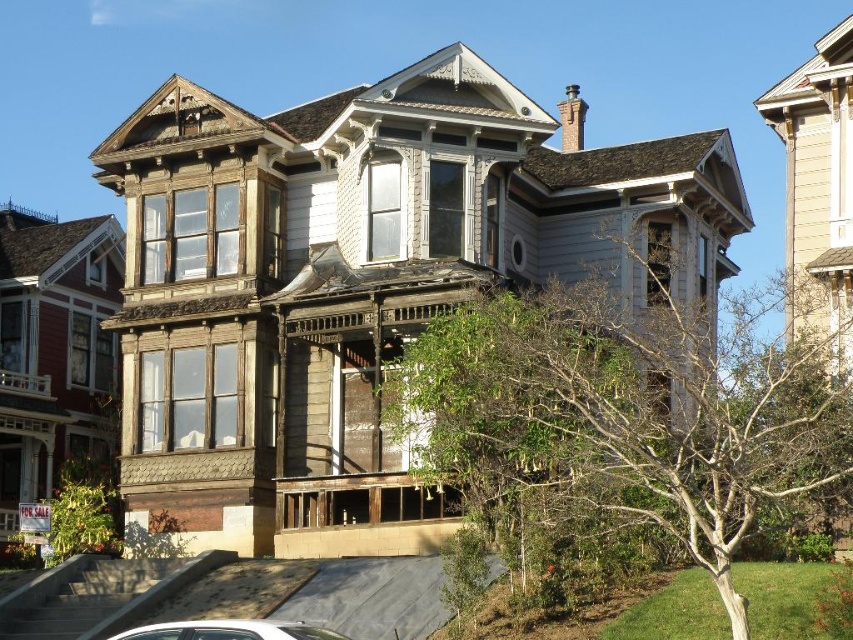
Question: Among these points, which one is farthest from the camera?

Choices:
 (A) (245, 634)
 (B) (701, 323)

Answer: (B)

Question: Is green leafy tree at center wider than white glossy car at lower left?

Choices:
 (A) no
 (B) yes

Answer: (B)

Question: Can you confirm if green leafy tree at center is wider than white glossy car at lower left?

Choices:
 (A) no
 (B) yes

Answer: (B)

Question: Is green leafy tree at center closer to the viewer compared to white glossy car at lower left?

Choices:
 (A) yes
 (B) no

Answer: (B)

Question: Which point is closer to the camera taking this photo?

Choices:
 (A) (170, 621)
 (B) (525, 417)

Answer: (B)